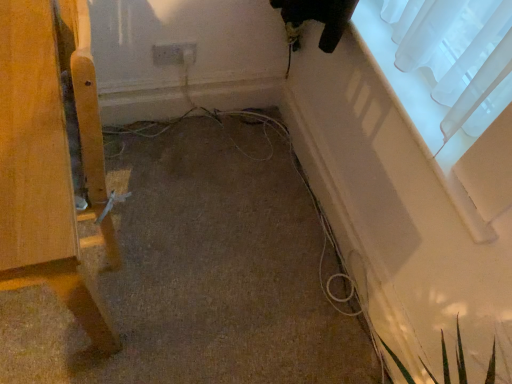
Question: Considering the relative sizes of transparent fabric at upper right and white plastic electric outlet at center in the image provided, is transparent fabric at upper right taller than white plastic electric outlet at center?

Choices:
 (A) no
 (B) yes

Answer: (A)

Question: Are transparent fabric at upper right and white plastic electric outlet at center located far from each other?

Choices:
 (A) no
 (B) yes

Answer: (A)

Question: Can you confirm if transparent fabric at upper right is smaller than white plastic electric outlet at center?

Choices:
 (A) no
 (B) yes

Answer: (A)

Question: Is transparent fabric at upper right positioned with its back to white plastic electric outlet at center?

Choices:
 (A) no
 (B) yes

Answer: (A)

Question: Is transparent fabric at upper right positioned behind white plastic electric outlet at center?

Choices:
 (A) yes
 (B) no

Answer: (B)

Question: Is transparent fabric at upper right positioned in front of white plastic electric outlet at center?

Choices:
 (A) no
 (B) yes

Answer: (B)

Question: Is white plastic electric outlet at center far away from wooden chair leg at left?

Choices:
 (A) no
 (B) yes

Answer: (A)

Question: Is white plastic electric outlet at center smaller than wooden chair leg at left?

Choices:
 (A) no
 (B) yes

Answer: (B)

Question: Is white plastic electric outlet at center located outside wooden chair leg at left?

Choices:
 (A) yes
 (B) no

Answer: (A)

Question: Can you see white plastic electric outlet at center touching wooden chair leg at left?

Choices:
 (A) no
 (B) yes

Answer: (A)

Question: Is white plastic electric outlet at center facing away from wooden chair leg at left?

Choices:
 (A) no
 (B) yes

Answer: (A)

Question: Is the position of white plastic electric outlet at center more distant than that of wooden chair leg at left?

Choices:
 (A) no
 (B) yes

Answer: (B)

Question: Is white plastic electric outlet at center touching transparent fabric at upper right?

Choices:
 (A) no
 (B) yes

Answer: (A)